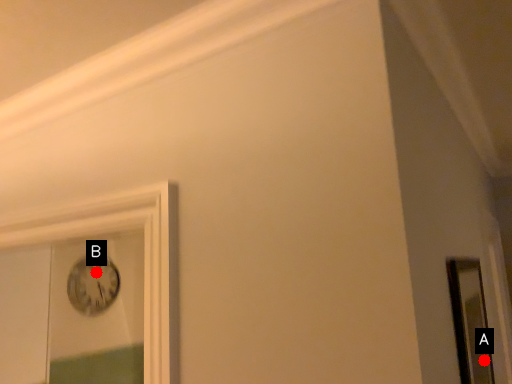
Question: Two points are circled on the image, labeled by A and B beside each circle. Which of the following is the closest to the observer?

Choices:
 (A) A is closer
 (B) B is closer

Answer: (A)